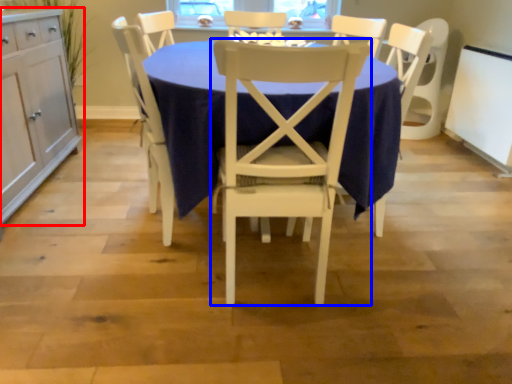
Question: Among these objects, which one is farthest to the camera, cabinetry (highlighted by a red box) or chair (highlighted by a blue box)?

Choices:
 (A) cabinetry
 (B) chair

Answer: (A)